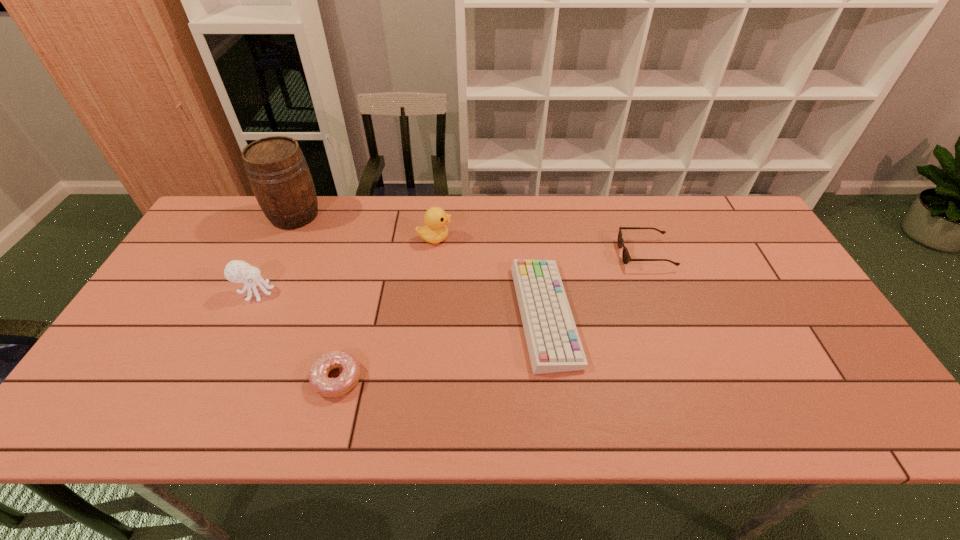
At what (x,y) coordinates should I click in order to perform the action: click on vacant region located on the front lenses of the sunglasses. Please return your answer as a coordinate pair (x, y). Looking at the image, I should click on (543, 254).

Where is `vacant area located 0.130m on the front lenses of the sunglasses`? This screenshot has width=960, height=540. vacant area located 0.130m on the front lenses of the sunglasses is located at coordinates (577, 254).

You are a GUI agent. You are given a task and a screenshot of the screen. Output one action in this format:
    pyautogui.click(x=<x>, y=<y>)
    Task: Click on the free location located on the back of the fifth object from left to right
    
    Given the screenshot: What is the action you would take?
    pyautogui.click(x=535, y=239)

The height and width of the screenshot is (540, 960). Find the location of `blank area located 0.150m on the right of the fourth object from right to left`. blank area located 0.150m on the right of the fourth object from right to left is located at coordinates (426, 379).

Where is `cider that is at the far edge`? cider that is at the far edge is located at coordinates (277, 171).

Identify the location of duck located at the far edge. The width and height of the screenshot is (960, 540). (435, 231).

Locate an element on the screen. sunglasses present at the far edge is located at coordinates (626, 257).

This screenshot has width=960, height=540. I want to click on object present at the near edge, so click(318, 376).

Where is `vacant region at the far edge of the desktop`? vacant region at the far edge of the desktop is located at coordinates (603, 206).

This screenshot has height=540, width=960. What are the coordinates of `vacant space at the near edge of the desktop` in the screenshot? It's located at (465, 424).